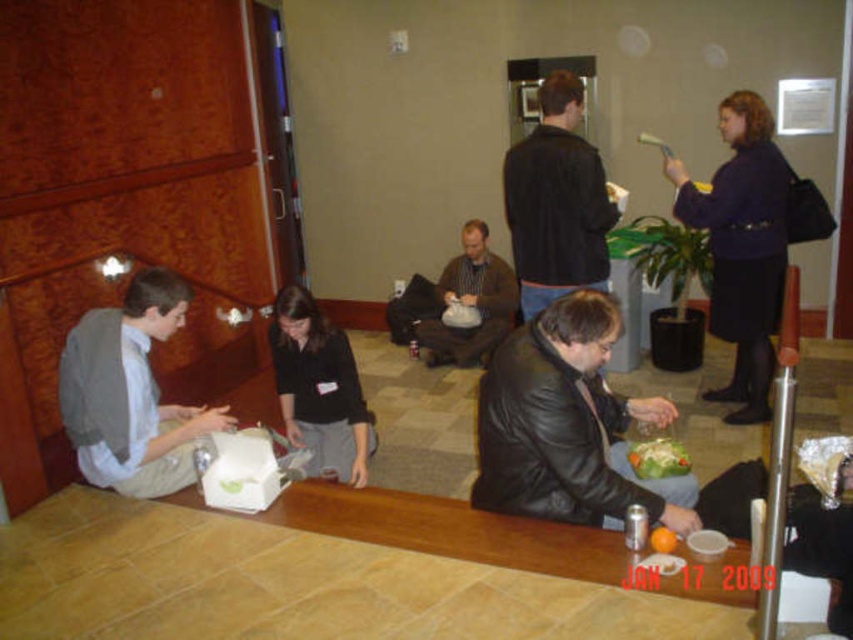
Question: Which object appears closest to the camera in this image?

Choices:
 (A) orange matte/orange at center
 (B) brown leather jacket at center
 (C) leather jacket at lower center
 (D) black leather jacket at upper center

Answer: (C)

Question: Is gray fabric shirt at lower left to the right of black leather jacket at upper center from the viewer's perspective?

Choices:
 (A) no
 (B) yes

Answer: (A)

Question: Can you confirm if leather jacket at lower center is thinner than gray fabric shirt at lower left?

Choices:
 (A) no
 (B) yes

Answer: (A)

Question: Does purple woolen sweater at upper right appear under black leather jacket at upper center?

Choices:
 (A) no
 (B) yes

Answer: (B)

Question: Which point is closer to the camera?

Choices:
 (A) gray fabric shirt at lower left
 (B) orange matte/orange at center

Answer: (B)

Question: Which object is positioned farthest from the leather jacket at lower center?

Choices:
 (A) purple woolen sweater at upper right
 (B) black leather jacket at upper center
 (C) black matte shirt at center
 (D) brown leather jacket at center

Answer: (D)